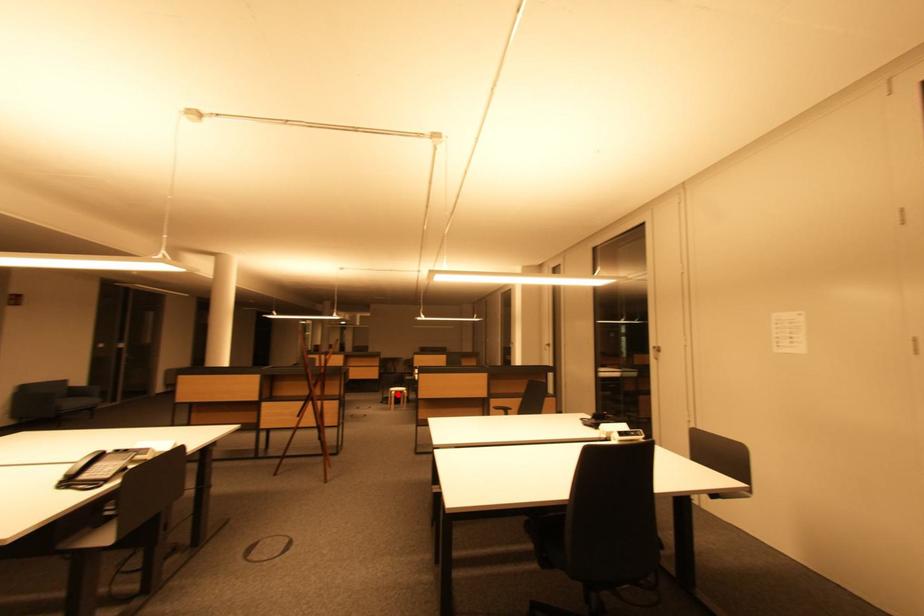
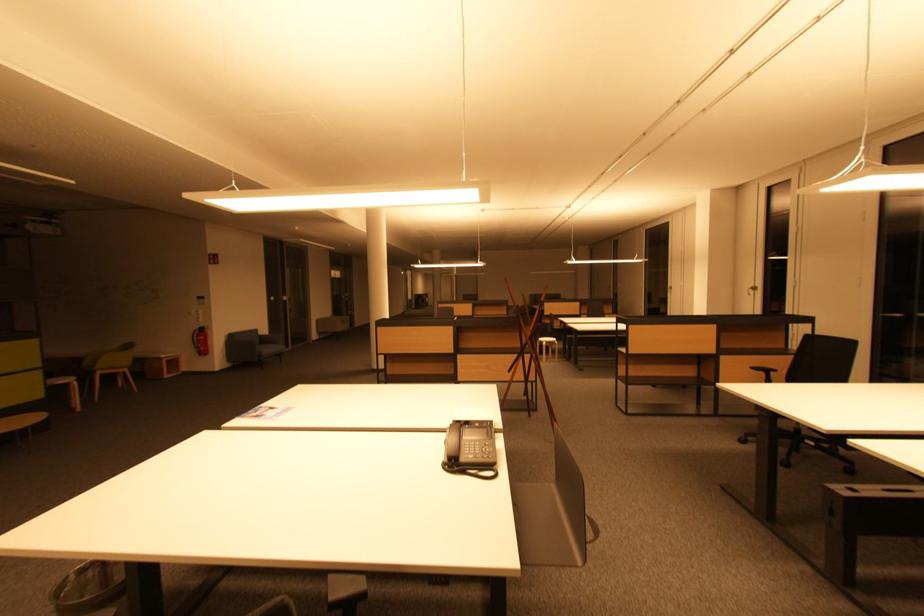
Find the pixel in the second image that matches the highlighted location in the first image.

(549, 345)